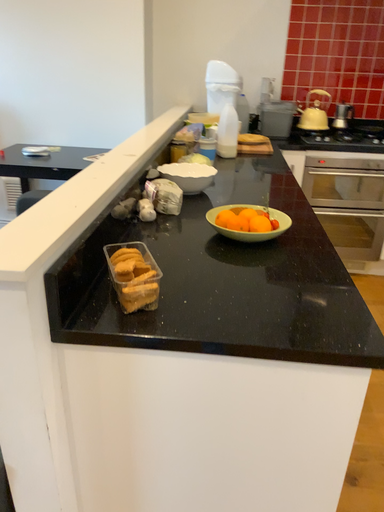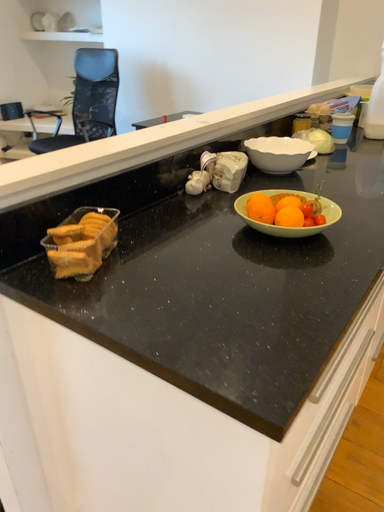
Question: How did the camera likely rotate when shooting the video?

Choices:
 (A) rotated left
 (B) rotated right

Answer: (A)